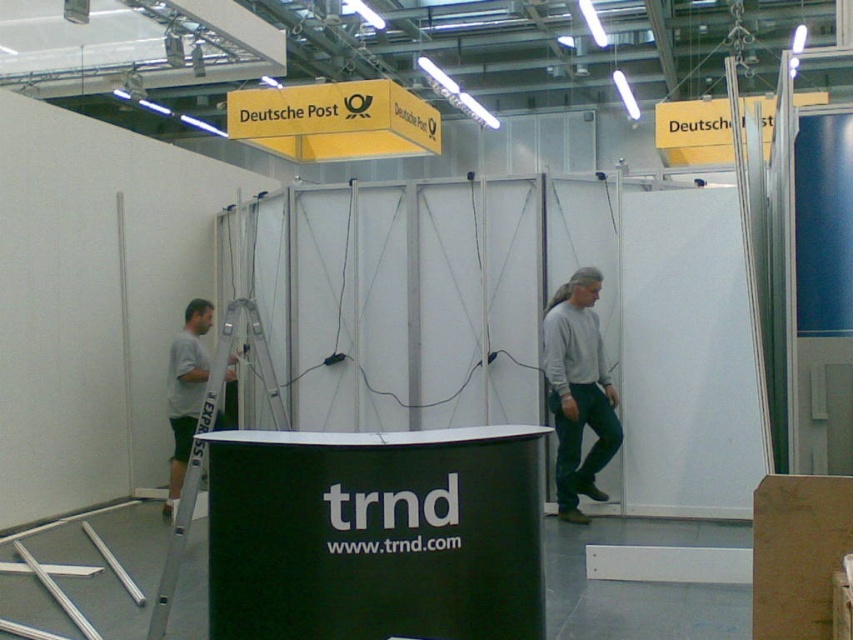
You are a visitor at the trade show and want to read the yellow paper sign at upper center. However, there is a gray sweater at center in your way. Can you see the sign over the sweater?

The gray sweater at center is taller than the yellow paper sign at upper center, so the sweater would block your view of the sign.

You are at the trade show and want to locate the Trnd booth. The Trnd counter has a rounded front edge. Where should you look for the Trnd counter in relation to the yellow matte sign at upper center marked by the point at coordinates (334, 120)?

The point at coordinates (334, 120) is on the yellow matte sign at upper center, so the Trnd counter with the rounded front edge is located below it.

You are a visitor at the exhibition and want to read the text on the yellow matte sign at upper center and the silver metallic ladder at left. Which object has a larger physical size?

The yellow matte sign at upper center is bigger than the silver metallic ladder at left, so the yellow matte sign at upper center has a larger physical size.